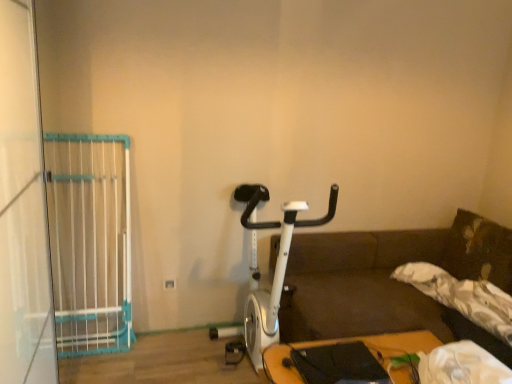
Question: Does wooden table at lower right have a greater height compared to white plastic gate at left?

Choices:
 (A) yes
 (B) no

Answer: (B)

Question: Is wooden table at lower right aimed at white plastic gate at left?

Choices:
 (A) no
 (B) yes

Answer: (A)

Question: From the image's perspective, does wooden table at lower right appear lower than white plastic gate at left?

Choices:
 (A) yes
 (B) no

Answer: (A)

Question: Does wooden table at lower right have a larger size compared to white plastic gate at left?

Choices:
 (A) no
 (B) yes

Answer: (A)

Question: Is wooden table at lower right smaller than white plastic gate at left?

Choices:
 (A) yes
 (B) no

Answer: (A)

Question: Does wooden table at lower right contain white plastic gate at left?

Choices:
 (A) yes
 (B) no

Answer: (B)

Question: Is wooden table at lower right outside of white metallic stationary bicycle at center?

Choices:
 (A) yes
 (B) no

Answer: (A)

Question: Considering the relative sizes of wooden table at lower right and white metallic stationary bicycle at center in the image provided, is wooden table at lower right taller than white metallic stationary bicycle at center?

Choices:
 (A) no
 (B) yes

Answer: (A)

Question: Considering the relative sizes of wooden table at lower right and white metallic stationary bicycle at center in the image provided, is wooden table at lower right shorter than white metallic stationary bicycle at center?

Choices:
 (A) yes
 (B) no

Answer: (A)

Question: Is wooden table at lower right positioned in front of white metallic stationary bicycle at center?

Choices:
 (A) yes
 (B) no

Answer: (A)

Question: From a real-world perspective, is wooden table at lower right under white metallic stationary bicycle at center?

Choices:
 (A) no
 (B) yes

Answer: (B)

Question: Can you confirm if wooden table at lower right is bigger than white metallic stationary bicycle at center?

Choices:
 (A) yes
 (B) no

Answer: (B)

Question: Would you say wooden table at lower right is a long distance from white plastic gate at left?

Choices:
 (A) yes
 (B) no

Answer: (A)